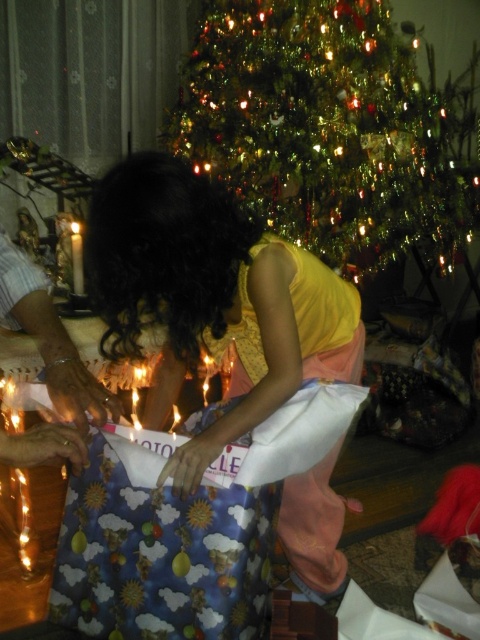
You are a photographer setting up a camera in front of the festive scene. You need to focus on both the matte yellow shirt at center and the white wax candle at center. Which object should you adjust your focus to first if you want to capture both clearly?

The matte yellow shirt at center is taller than the white wax candle at center, so you should focus on the taller matte yellow shirt at center first to ensure both are in clear view.

Looking at the festive scene with the Christmas tree, you notice the matte yellow shirt at center and the white wax candle at center. Which object is positioned to the right side?

The matte yellow shirt at center is to the right of the white wax candle at center.